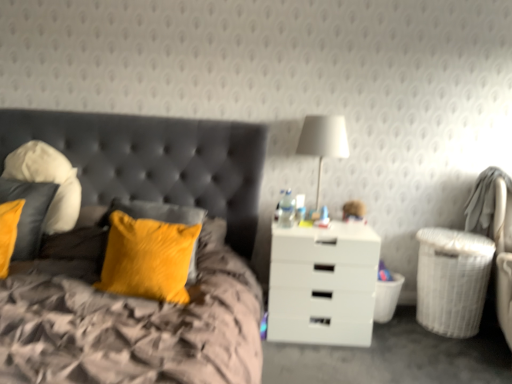
Question: Is there a large distance between velvet yellow pillow at upper left and velvet yellow pillow at left, which is the 2th pillow from right to left?

Choices:
 (A) no
 (B) yes

Answer: (A)

Question: From the image's perspective, is velvet yellow pillow at upper left under velvet yellow pillow at left, which is the 2th pillow from right to left?

Choices:
 (A) yes
 (B) no

Answer: (A)

Question: Is velvet yellow pillow at upper left at the left side of velvet yellow pillow at left, marked as the 2th pillow in a left-to-right arrangement?

Choices:
 (A) no
 (B) yes

Answer: (A)

Question: Is velvet yellow pillow at upper left looking in the opposite direction of velvet yellow pillow at left, which is the 2th pillow from right to left?

Choices:
 (A) yes
 (B) no

Answer: (A)

Question: Is velvet yellow pillow at upper left smaller than velvet yellow pillow at left, which is the 2th pillow from right to left?

Choices:
 (A) yes
 (B) no

Answer: (B)

Question: From a real-world perspective, relative to velvet yellow pillow at upper left, is soft white pillow at left, which is counted as the third pillow, starting from the right, vertically above or below?

Choices:
 (A) above
 (B) below

Answer: (A)

Question: Considering the relative positions of soft white pillow at left, the 1th pillow positioned from the left, and velvet yellow pillow at upper left in the image provided, is soft white pillow at left, the 1th pillow positioned from the left, to the left or to the right of velvet yellow pillow at upper left?

Choices:
 (A) left
 (B) right

Answer: (A)

Question: Considering the positions of point (67, 201) and point (29, 326), is point (67, 201) closer or farther from the camera than point (29, 326)?

Choices:
 (A) closer
 (B) farther

Answer: (B)

Question: Choose the correct answer: Is soft white pillow at left, the 1th pillow positioned from the left, inside velvet yellow pillow at upper left or outside it?

Choices:
 (A) outside
 (B) inside

Answer: (B)

Question: Based on their sizes in the image, would you say velvet yellow pillow at left, marked as the 2th pillow in a left-to-right arrangement, is bigger or smaller than white wicker laundry basket at right, placed as the 2th laundry basket when sorted from right to left?

Choices:
 (A) small
 (B) big

Answer: (B)

Question: Looking at their shapes, would you say velvet yellow pillow at left, which is the 2th pillow from right to left, is wider or thinner than white wicker laundry basket at right, placed as the 2th laundry basket when sorted from right to left?

Choices:
 (A) wide
 (B) thin

Answer: (A)

Question: Choose the correct answer: Is velvet yellow pillow at left, marked as the 2th pillow in a left-to-right arrangement, inside white wicker laundry basket at right, placed as the first laundry basket when sorted from left to right, or outside it?

Choices:
 (A) inside
 (B) outside

Answer: (B)

Question: From the image's perspective, is velvet yellow pillow at left, marked as the 2th pillow in a left-to-right arrangement, above or below white wicker laundry basket at right, placed as the first laundry basket when sorted from left to right?

Choices:
 (A) below
 (B) above

Answer: (B)

Question: Is white wicker laundry basket at lower right, positioned as the 2th laundry basket in left-to-right order, spatially inside soft white pillow at left, which is counted as the third pillow, starting from the right, or outside of it?

Choices:
 (A) inside
 (B) outside

Answer: (B)

Question: Considering the positions of point (455, 327) and point (40, 162), is point (455, 327) closer or farther from the camera than point (40, 162)?

Choices:
 (A) closer
 (B) farther

Answer: (B)